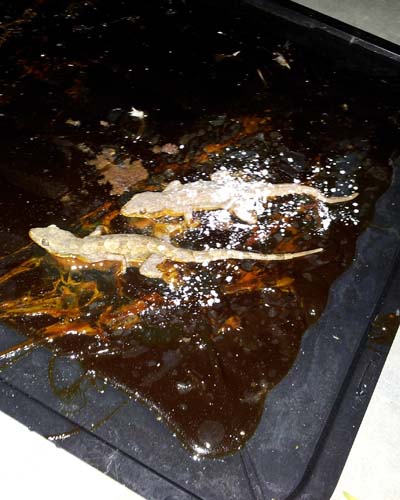
This screenshot has width=400, height=500. I want to click on outer border of mat, so click(334, 471).